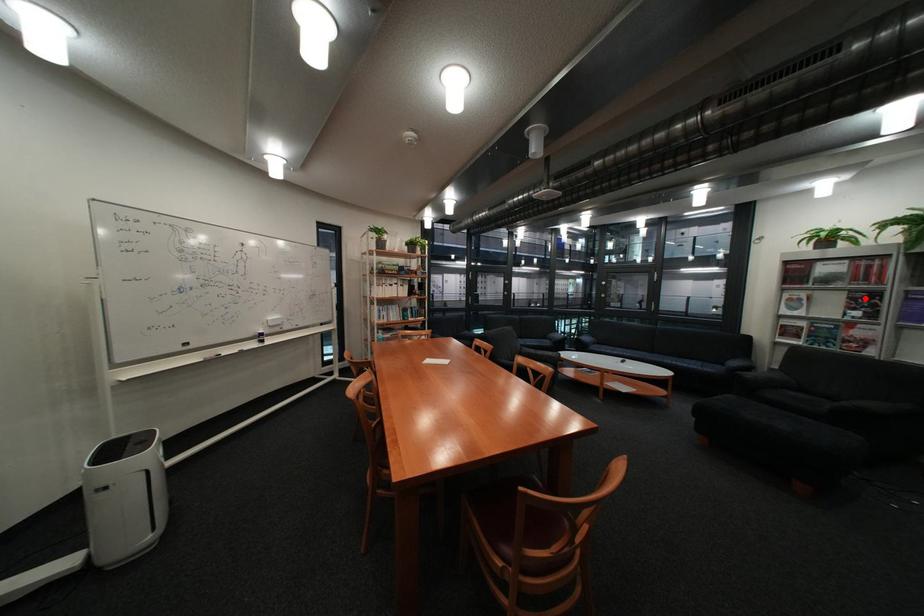
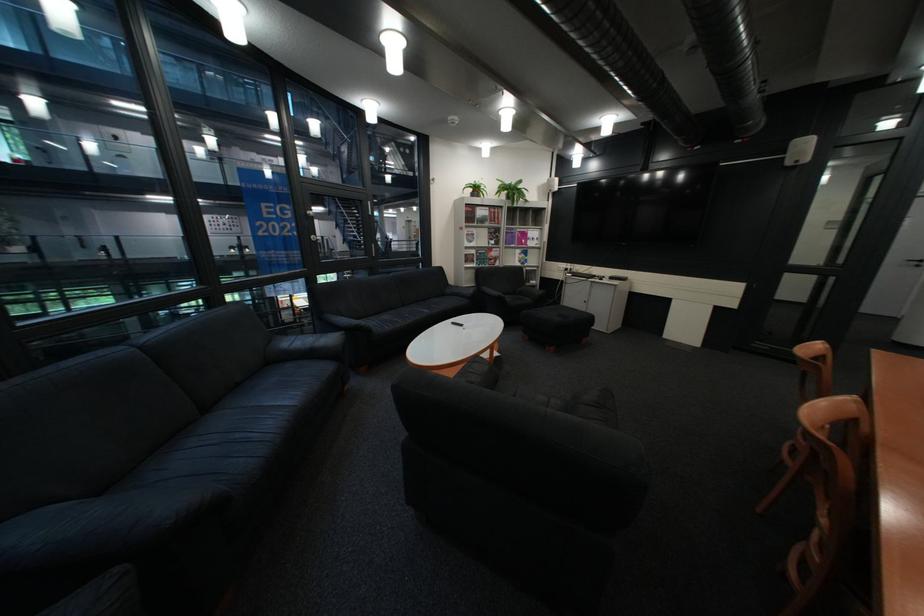
Question: I am providing you with two images of the same scene from different viewpoints. Image1 has a red point marked. In image2, the corresponding 3D location appears at what relative position? Reply with the corresponding letter.

Choices:
 (A) Closer
 (B) Farther

Answer: (A)